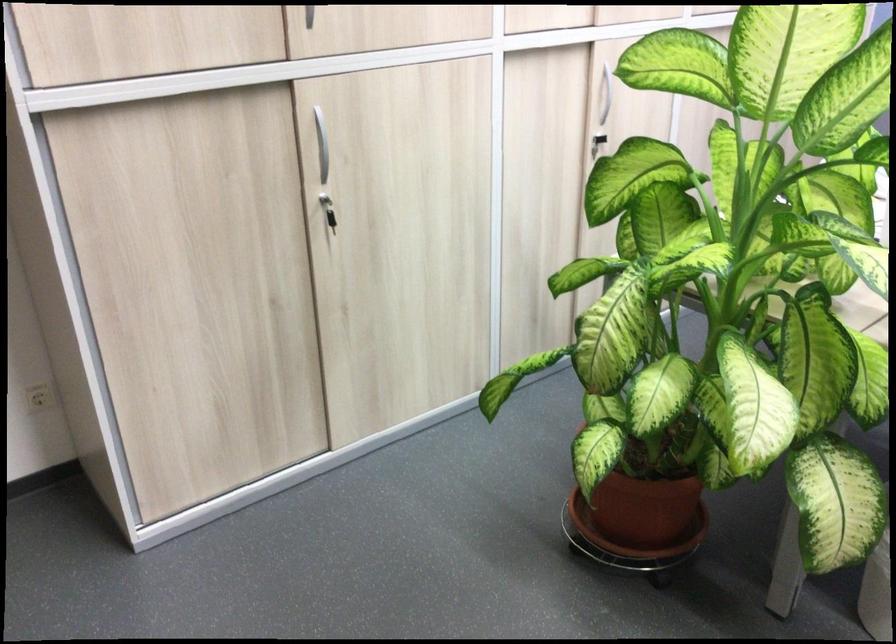
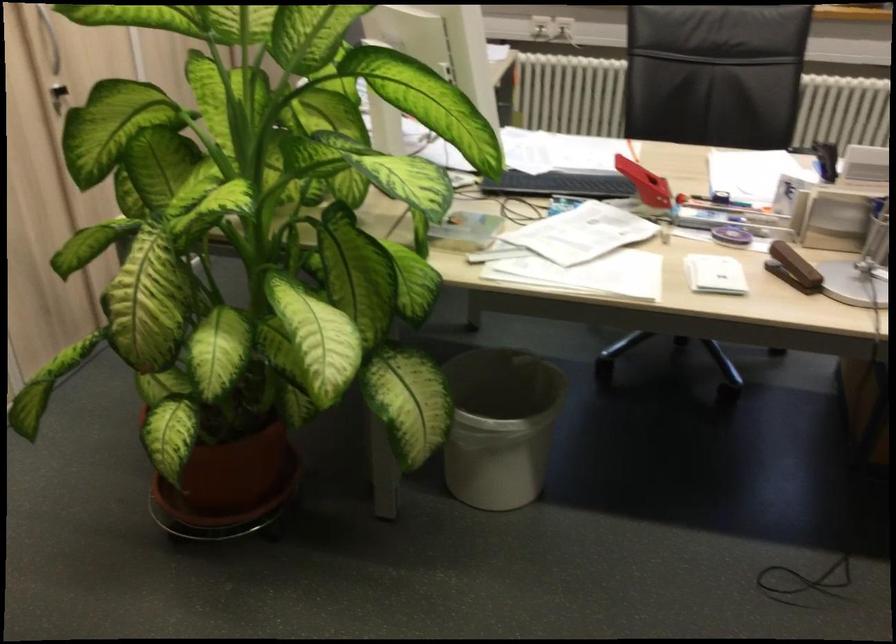
Locate, in the second image, the point that corresponds to (x=590, y=142) in the first image.

(57, 96)